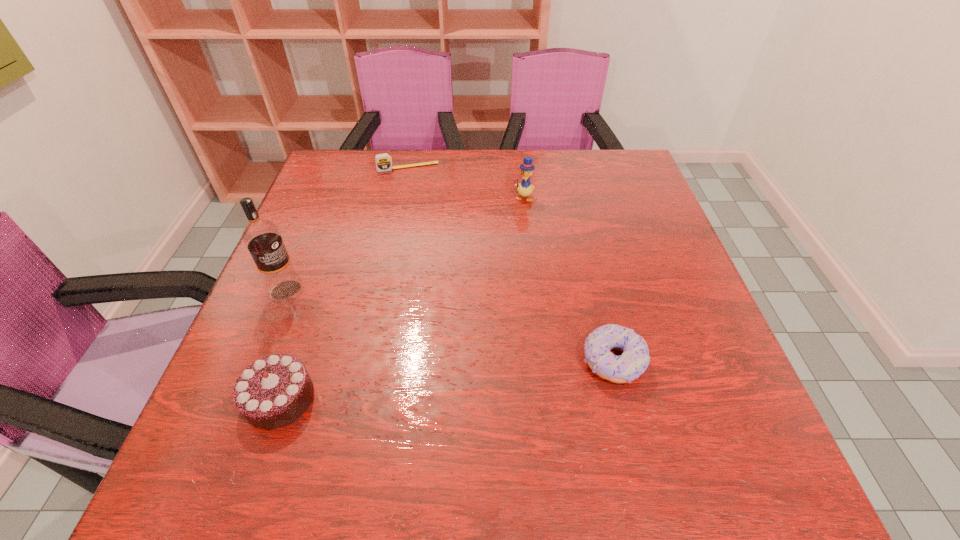
What are the coordinates of `free space at the near edge of the desktop` in the screenshot? It's located at (337, 419).

Locate an element on the screen. The width and height of the screenshot is (960, 540). vacant space at the left edge of the desktop is located at coordinates (327, 289).

Where is `free point at the right edge`? free point at the right edge is located at coordinates (643, 292).

Find the location of a particular element. free point between the duckling and the doughnut is located at coordinates (568, 279).

This screenshot has height=540, width=960. Find the location of `unoccupied position between the duckling and the rightmost object`. unoccupied position between the duckling and the rightmost object is located at coordinates (568, 279).

In order to click on vacant area that lies between the tape measure and the second object from right to left in this screenshot , I will do coord(466,182).

You are a GUI agent. You are given a task and a screenshot of the screen. Output one action in this format:
    pyautogui.click(x=<x>, y=<y>)
    Task: Click on the unoccupied position between the duckling and the rightmost object
    
    Given the screenshot: What is the action you would take?
    pyautogui.click(x=568, y=279)

At what (x,y) coordinates should I click in order to perform the action: click on free point between the rightmost object and the second object from right to left. Please return your answer as a coordinate pair (x, y). The width and height of the screenshot is (960, 540). Looking at the image, I should click on (568, 279).

The image size is (960, 540). In order to click on empty space that is in between the farthest object and the doughnut in this screenshot , I will do `click(511, 264)`.

Identify the location of empty space between the third shortest object and the second farthest object. The height and width of the screenshot is (540, 960). (401, 298).